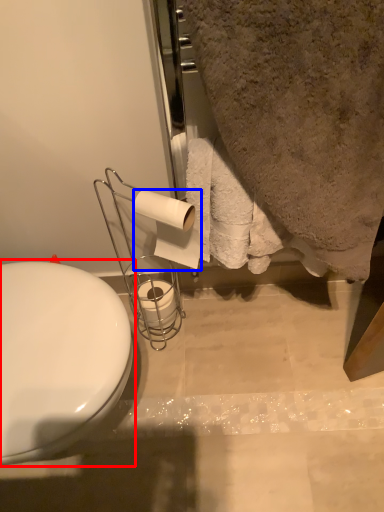
Question: Among these objects, which one is farthest to the camera, toilet (highlighted by a red box) or toilet paper (highlighted by a blue box)?

Choices:
 (A) toilet
 (B) toilet paper

Answer: (B)